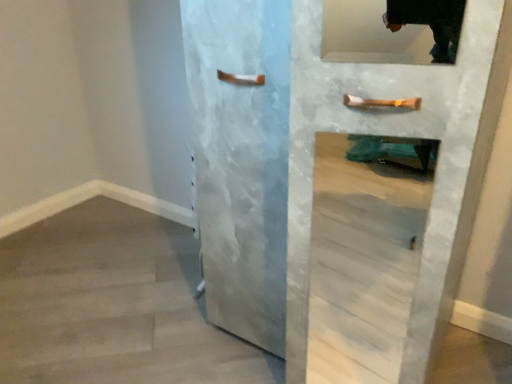
What is the approximate width of matte white cabinet at center?

The width of matte white cabinet at center is 25.72 inches.

What do you see at coordinates (383, 134) in the screenshot? I see `matte white cabinet at center` at bounding box center [383, 134].

Image resolution: width=512 pixels, height=384 pixels. I want to click on matte white cabinet at center, so click(383, 134).

The height and width of the screenshot is (384, 512). Identify the location of matte white cabinet at center. (383, 134).